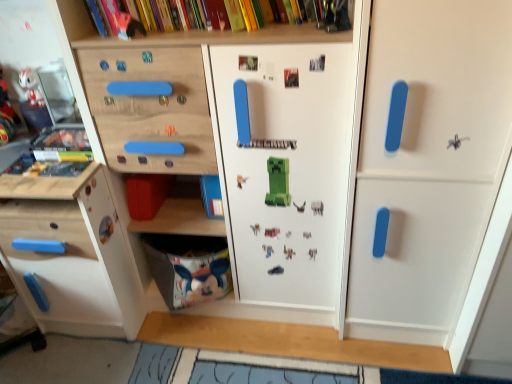
What is the approximate width of white fabric bag at lower center?

white fabric bag at lower center is 9.25 inches in width.

The image size is (512, 384). What do you see at coordinates (31, 87) in the screenshot?
I see `matte plastic rabbit at upper left` at bounding box center [31, 87].

Identify the location of white matte door at right. (428, 164).

Where is `white fabric bag at lower center`? The height and width of the screenshot is (384, 512). white fabric bag at lower center is located at coordinates (x=188, y=268).

Is point (39, 102) farther from camera compared to point (364, 121)?

Yes, it is behind point (364, 121).

Are matte plastic rabbit at upper left and white matte door at right far apart?

Absolutely, matte plastic rabbit at upper left is distant from white matte door at right.

Between matte plastic rabbit at upper left and white matte door at right, which one has smaller width?

With smaller width is matte plastic rabbit at upper left.

Is matte plastic rabbit at upper left located outside white matte door at right?

Indeed, matte plastic rabbit at upper left is completely outside white matte door at right.

Considering the positions of objects matte plastic rabbit at upper left and white fabric bag at lower center in the image provided, who is in front, matte plastic rabbit at upper left or white fabric bag at lower center?

white fabric bag at lower center is in front.

Where is `toy to the left of white fabric bag at lower center`? This screenshot has height=384, width=512. toy to the left of white fabric bag at lower center is located at coordinates (31, 87).

From the image's perspective, is matte plastic rabbit at upper left located beneath white fabric bag at lower center?

No.

Between matte plastic rabbit at upper left and white fabric bag at lower center, which one has larger width?

white fabric bag at lower center is wider.

Consider the image. From the image's perspective, which is below, white matte door at right or matte plastic rabbit at upper left?

white matte door at right appears lower in the image.

From a real-world perspective, who is located lower, white matte door at right or matte plastic rabbit at upper left?

white matte door at right.

Identify the location of door in front of the matte plastic rabbit at upper left. This screenshot has width=512, height=384. (428, 164).

Considering the relative sizes of white matte door at right and matte plastic rabbit at upper left in the image provided, is white matte door at right smaller than matte plastic rabbit at upper left?

Actually, white matte door at right might be larger than matte plastic rabbit at upper left.

Which is nearer, [212,259] or [487,185]?

Point [212,259] is farther from the camera than point [487,185].

Can you see white fabric bag at lower center touching white matte door at right?

No, white fabric bag at lower center is not with white matte door at right.

Visually, is white fabric bag at lower center positioned to the left or to the right of white matte door at right?

From the image, it's evident that white fabric bag at lower center is to the left of white matte door at right.

Who is smaller, white fabric bag at lower center or white matte door at right?

white fabric bag at lower center.

Is white fabric bag at lower center at the back of white matte door at right?

No, white matte door at right is not facing the opposite direction of white fabric bag at lower center.

Consider the image. Is white fabric bag at lower center surrounded by white matte door at right?

No, white fabric bag at lower center is not a part of white matte door at right.

The width and height of the screenshot is (512, 384). In order to click on door above the white fabric bag at lower center (from the image's perspective) in this screenshot , I will do `click(428, 164)`.

Is white fabric bag at lower center positioned far away from matte plastic rabbit at upper left?

That's not correct — white fabric bag at lower center is a little close to matte plastic rabbit at upper left.

Does white fabric bag at lower center have a lesser height compared to matte plastic rabbit at upper left?

No, white fabric bag at lower center is not shorter than matte plastic rabbit at upper left.

Is point (170, 278) in front of point (42, 98)?

No, it is not.

Is white fabric bag at lower center oriented away from matte plastic rabbit at upper left?

No, white fabric bag at lower center's orientation is not away from matte plastic rabbit at upper left.

At what (x,y) coordinates should I click in order to perform the action: click on toy behind the white matte door at right. Please return your answer as a coordinate pair (x, y). This screenshot has width=512, height=384. Looking at the image, I should click on (31, 87).

What are the coordinates of `toy above the white fabric bag at lower center (from the image's perspective)` in the screenshot? It's located at (31, 87).

Based on their spatial positions, is matte plastic rabbit at upper left or white fabric bag at lower center further from white matte door at right?

Among the two, matte plastic rabbit at upper left is located further to white matte door at right.

Which object lies further to the anchor point white matte door at right, white fabric bag at lower center or matte plastic rabbit at upper left?

Based on the image, matte plastic rabbit at upper left appears to be further to white matte door at right.

Based on their spatial positions, is white fabric bag at lower center or white matte door at right further from matte plastic rabbit at upper left?

Based on the image, white matte door at right appears to be further to matte plastic rabbit at upper left.

Considering their positions, is white matte door at right positioned further to matte plastic rabbit at upper left than white fabric bag at lower center?

Based on the image, white matte door at right appears to be further to matte plastic rabbit at upper left.

When comparing their distances from white fabric bag at lower center, does white matte door at right or matte plastic rabbit at upper left seem closer?

white matte door at right is positioned closer to the anchor white fabric bag at lower center.

From the image, which object appears to be nearer to white fabric bag at lower center, matte plastic rabbit at upper left or white matte door at right?

white matte door at right is closer to white fabric bag at lower center.

The height and width of the screenshot is (384, 512). Find the location of `drawer between matte plastic rabbit at upper left and white matte door at right`. drawer between matte plastic rabbit at upper left and white matte door at right is located at coordinates (188, 268).